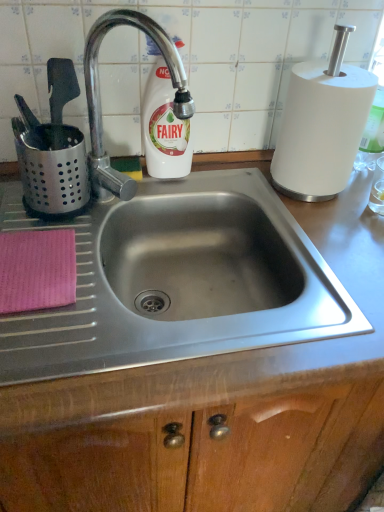
Locate an element on the screen. The width and height of the screenshot is (384, 512). free location to the right of pink woven cloth at lower left is located at coordinates (110, 305).